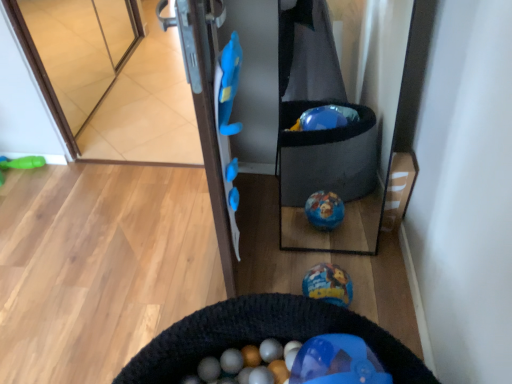
Question: Is black knitted cat bed at lower center surrounding shiny metallic ball at center, which is the first toy from bottom to top?

Choices:
 (A) yes
 (B) no

Answer: (B)

Question: Does black knitted cat bed at lower center have a lesser width compared to shiny metallic ball at center, which is counted as the first toy, starting from the right?

Choices:
 (A) yes
 (B) no

Answer: (B)

Question: Is black knitted cat bed at lower center located outside shiny metallic ball at center, positioned as the 1th toy in front-to-back order?

Choices:
 (A) no
 (B) yes

Answer: (B)

Question: Is black knitted cat bed at lower center bigger than shiny metallic ball at center, which is the first toy from bottom to top?

Choices:
 (A) no
 (B) yes

Answer: (B)

Question: From a real-world perspective, is black knitted cat bed at lower center located higher than shiny metallic ball at center, the 2th toy viewed from the left?

Choices:
 (A) no
 (B) yes

Answer: (B)

Question: From the image's perspective, is black knitted cat bed at lower center below shiny metallic ball at center, which is the first toy from bottom to top?

Choices:
 (A) no
 (B) yes

Answer: (B)

Question: Does transparent glass door at upper left have a greater height compared to green rubber toy at left, which is the 2th toy from bottom to top?

Choices:
 (A) no
 (B) yes

Answer: (B)

Question: Does transparent glass door at upper left have a smaller size compared to green rubber toy at left, which is the 2th toy from bottom to top?

Choices:
 (A) no
 (B) yes

Answer: (A)

Question: Is transparent glass door at upper left closer to the viewer compared to green rubber toy at left, marked as the 1th toy in a back-to-front arrangement?

Choices:
 (A) no
 (B) yes

Answer: (B)

Question: Is transparent glass door at upper left outside of green rubber toy at left, which appears as the 1th toy when viewed from the top?

Choices:
 (A) no
 (B) yes

Answer: (B)

Question: From a real-world perspective, is transparent glass door at upper left located higher than green rubber toy at left, which appears as the 1th toy when viewed from the top?

Choices:
 (A) no
 (B) yes

Answer: (B)

Question: From a real-world perspective, is transparent glass door at upper left located beneath green rubber toy at left, which appears as the 1th toy when viewed from the top?

Choices:
 (A) yes
 (B) no

Answer: (B)

Question: Is black knitted cat bed at lower center outside transparent glass door at upper left?

Choices:
 (A) yes
 (B) no

Answer: (A)